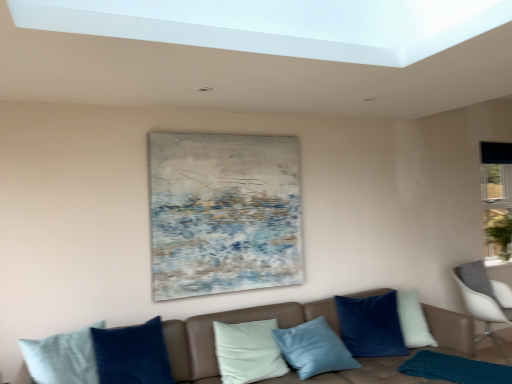
Question: Is textured canvas painting at upper center at the left side of brown leather couch at lower center?

Choices:
 (A) yes
 (B) no

Answer: (A)

Question: Can you confirm if textured canvas painting at upper center is positioned to the right of brown leather couch at lower center?

Choices:
 (A) no
 (B) yes

Answer: (A)

Question: Does textured canvas painting at upper center touch brown leather couch at lower center?

Choices:
 (A) yes
 (B) no

Answer: (B)

Question: Can you confirm if textured canvas painting at upper center is wider than brown leather couch at lower center?

Choices:
 (A) no
 (B) yes

Answer: (A)

Question: Does textured canvas painting at upper center have a smaller size compared to brown leather couch at lower center?

Choices:
 (A) no
 (B) yes

Answer: (B)

Question: Is textured canvas painting at upper center bigger or smaller than teal knitted mat at lower right?

Choices:
 (A) small
 (B) big

Answer: (B)

Question: Is textured canvas painting at upper center spatially inside teal knitted mat at lower right, or outside of it?

Choices:
 (A) outside
 (B) inside

Answer: (A)

Question: Considering their positions, is textured canvas painting at upper center located in front of or behind teal knitted mat at lower right?

Choices:
 (A) front
 (B) behind

Answer: (B)

Question: From the image's perspective, relative to teal knitted mat at lower right, is textured canvas painting at upper center above or below?

Choices:
 (A) below
 (B) above

Answer: (B)

Question: Is velvet blue pillow at center taller or shorter than brown leather couch at lower center?

Choices:
 (A) short
 (B) tall

Answer: (A)

Question: Is velvet blue pillow at center in front of or behind brown leather couch at lower center in the image?

Choices:
 (A) behind
 (B) front

Answer: (A)

Question: Is velvet blue pillow at center situated inside brown leather couch at lower center or outside?

Choices:
 (A) inside
 (B) outside

Answer: (A)

Question: From the image's perspective, is velvet blue pillow at center located above or below brown leather couch at lower center?

Choices:
 (A) below
 (B) above

Answer: (B)

Question: Visually, is teal knitted mat at lower right positioned to the left or to the right of white glossy window sill at lower right?

Choices:
 (A) right
 (B) left

Answer: (B)

Question: From a real-world perspective, is teal knitted mat at lower right physically located above or below white glossy window sill at lower right?

Choices:
 (A) above
 (B) below

Answer: (B)